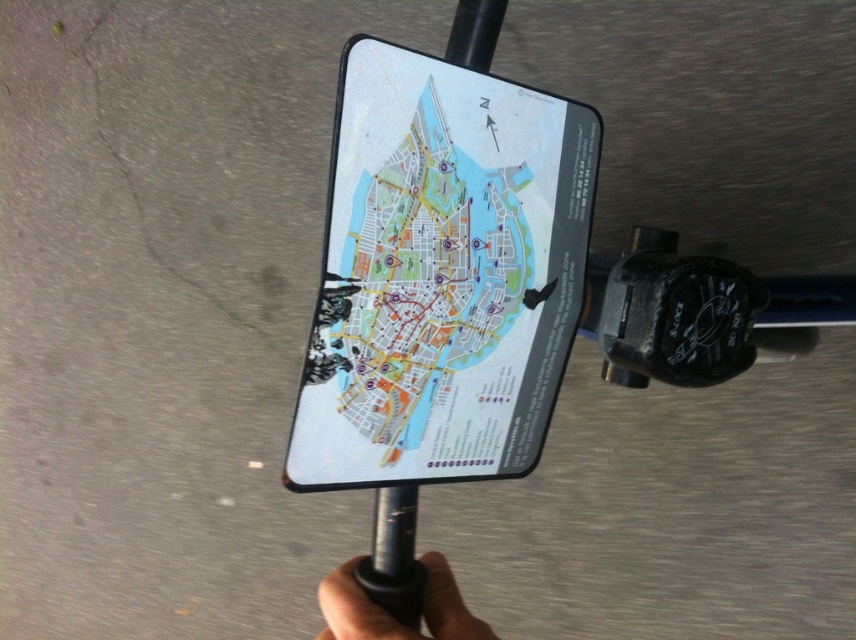
Question: Which object is closer to the camera taking this photo?

Choices:
 (A) white matte map at center
 (B) black matte grip at lower center
 (C) black matte phone at center

Answer: (A)

Question: Is white matte map at center positioned in front of black matte grip at lower center?

Choices:
 (A) no
 (B) yes

Answer: (B)

Question: Does white matte map at center have a larger size compared to black matte phone at center?

Choices:
 (A) no
 (B) yes

Answer: (B)

Question: Is the position of black matte phone at center less distant than that of black matte grip at lower center?

Choices:
 (A) no
 (B) yes

Answer: (A)

Question: Which point is farther to the camera?

Choices:
 (A) (366, 420)
 (B) (462, 604)

Answer: (B)

Question: Which of these objects is positioned farthest from the black matte grip at lower center?

Choices:
 (A) black matte phone at center
 (B) white matte map at center

Answer: (B)